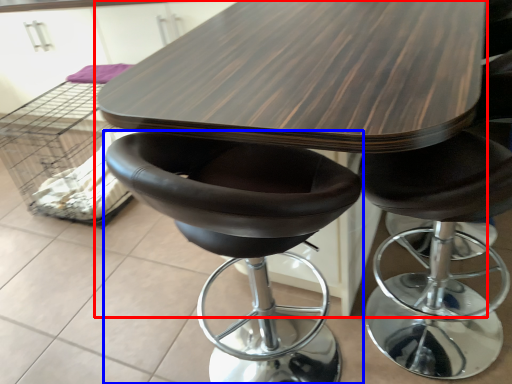
Question: Among these objects, which one is farthest to the camera, table (highlighted by a red box) or chair (highlighted by a blue box)?

Choices:
 (A) table
 (B) chair

Answer: (A)